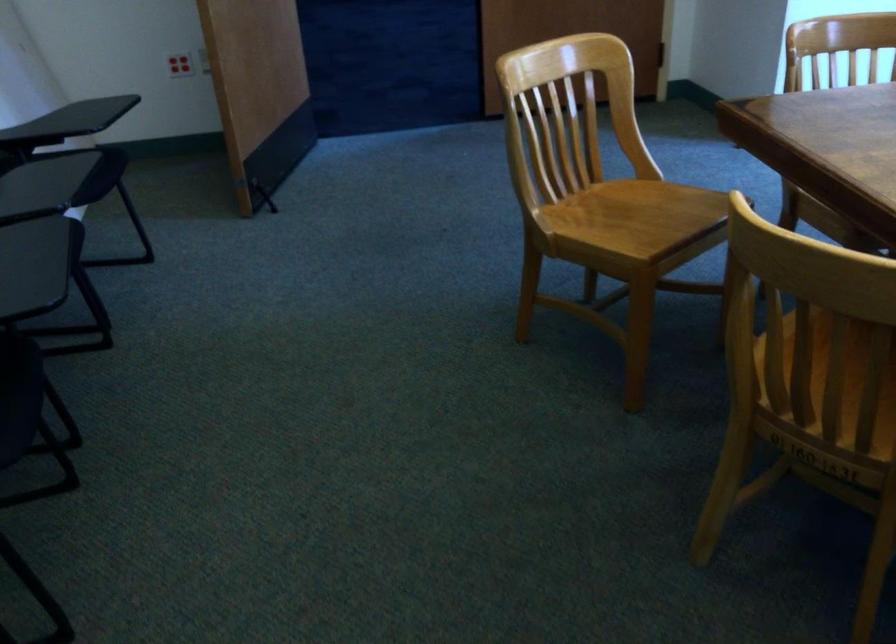
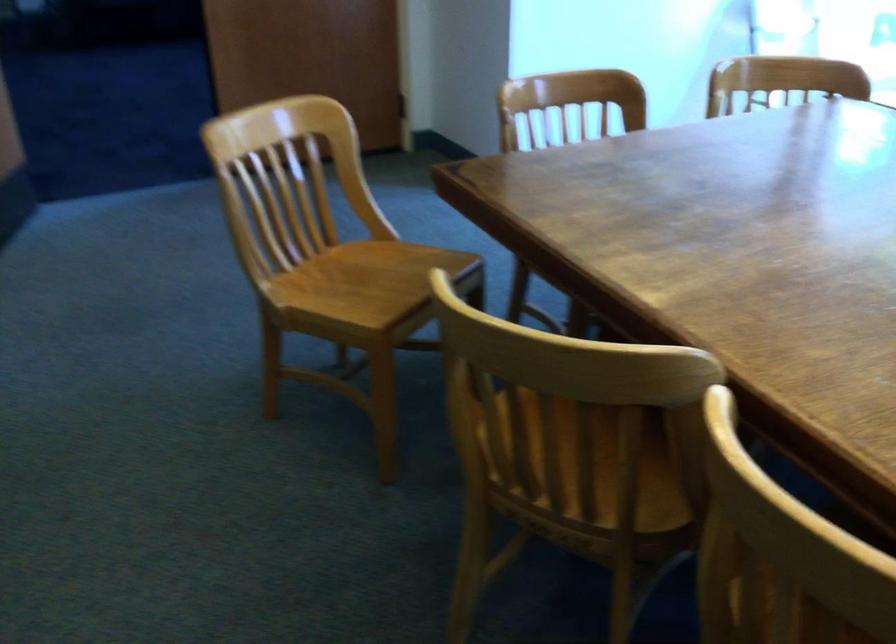
Question: The first image is from the beginning of the video and the second image is from the end. How did the camera likely rotate when shooting the video?

Choices:
 (A) Left
 (B) Right
 (C) Up
 (D) Down

Answer: (B)